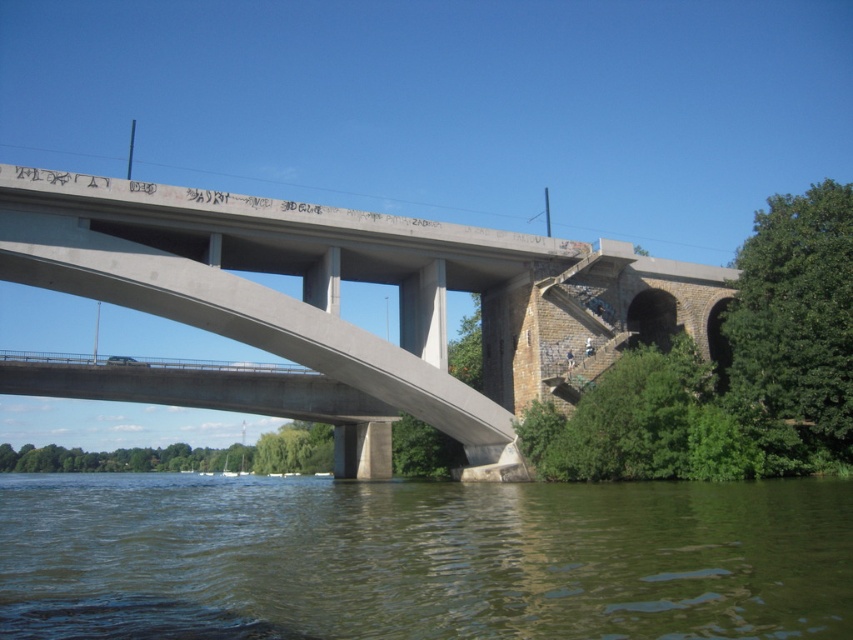
You are a delivery drone carrying a package that weighs 50 pounds. The maximum flight distance your drone can travel without recharging is 50 feet. You need to deliver the package to a boat located on the greenish water at lower center. Your current position is near the concrete bridge at center. Can you safely make the delivery without needing to recharge?

The distance between the greenish water at lower center and the concrete bridge at center is 46.14 feet, which is within the drone s 50 feet maximum flight distance. Therefore, the drone can safely deliver the package to the boat on the greenish water at lower center without needing to recharge.

You are a delivery drone flying over the greenish water at lower center and need to land on the concrete bridge at center. Based on the scene, can you safely land on the bridge without crossing over the water?

The greenish water at lower center is located below the concrete bridge at center, so you can safely land on the concrete bridge at center by approaching from above or the sides without needing to cross over the water.